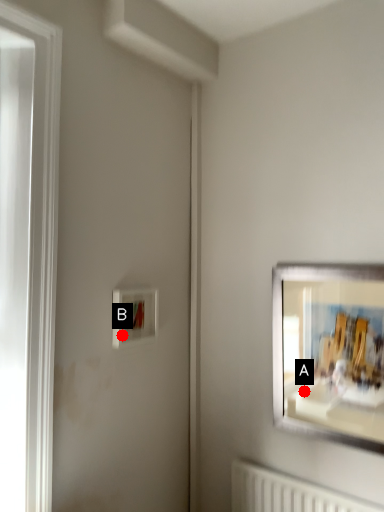
Question: Two points are circled on the image, labeled by A and B beside each circle. Which point appears farthest from the camera in this image?

Choices:
 (A) A is further
 (B) B is further

Answer: (B)